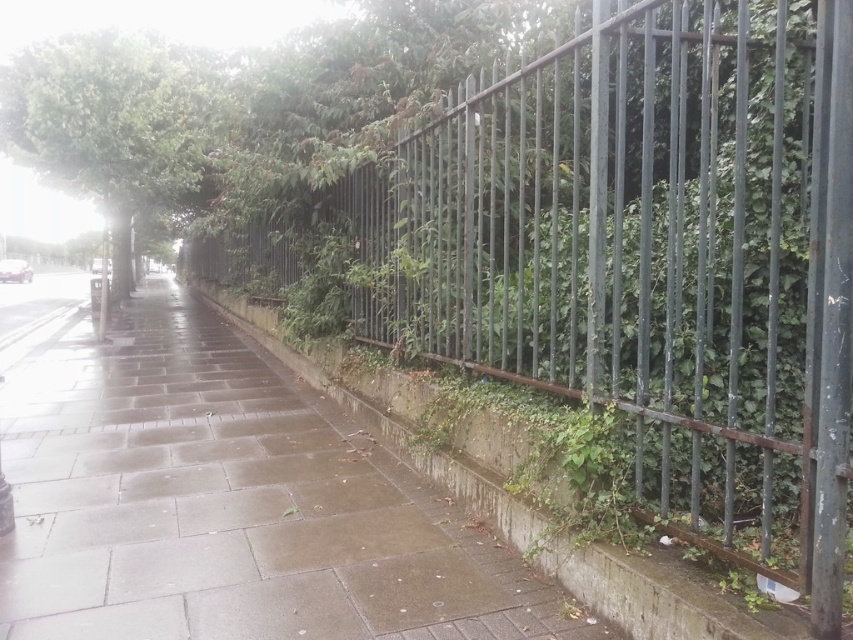
You are a delivery person trying to navigate a narrow path between the gray concrete pavement at center and the green leafy tree at upper left. Which one has a larger width to allow easier passage?

The gray concrete pavement at center has a larger width than the green leafy tree at upper left, so it allows easier passage.

From the picture: You are standing on the gray concrete pavement at center and want to avoid getting wet from the rain. The green leafy tree at upper left has a large canopy. Can you stand under the tree to stay dry?

The gray concrete pavement at center is positioned under green leafy tree at upper left, so yes, you can stand under the tree to stay dry from the rain.